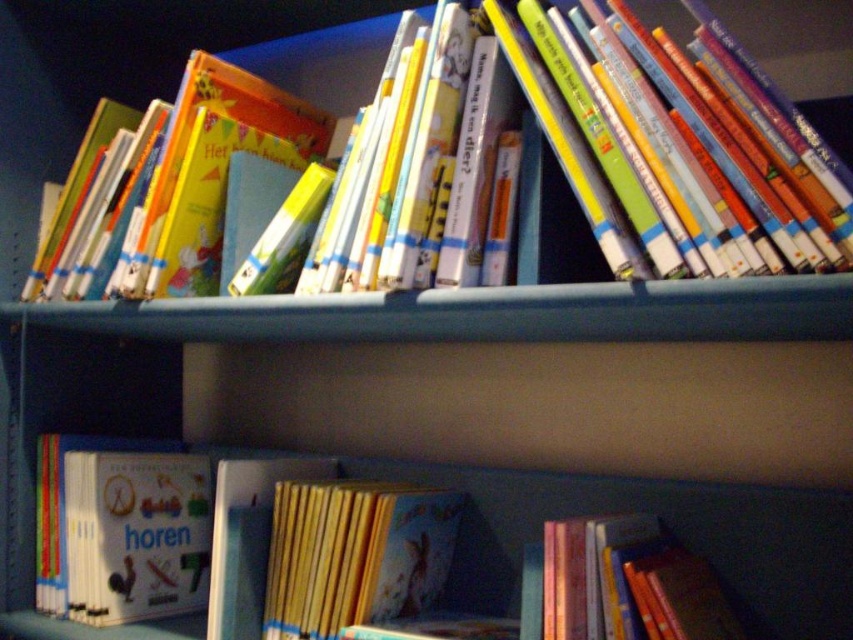
You are organizing the books on the bookshelf and notice the yellow paper at center and the shiny pink book at lower right. Which object would you need to place on a shelf that can support thinner items?

The yellow paper at center is thinner than the shiny pink book at lower right, so it should be placed on a shelf that can support thinner items.

You are organizing a bookshelf and notice the matte white book at left and the yellow paper at center. Which item is closer to you from your current viewpoint?

The matte white book at left is closer to you because the yellow paper at center is behind it.

You are a librarian organizing books on a shelf. You have a new book that is 12 inches wide. Can you place it between the matte white book at left and the yellow paper at center without moving them?

The distance between the matte white book at left and yellow paper at center is 12.11 inches. Since the new book is 12 inches wide, it can fit between them as the space is slightly larger than the book.